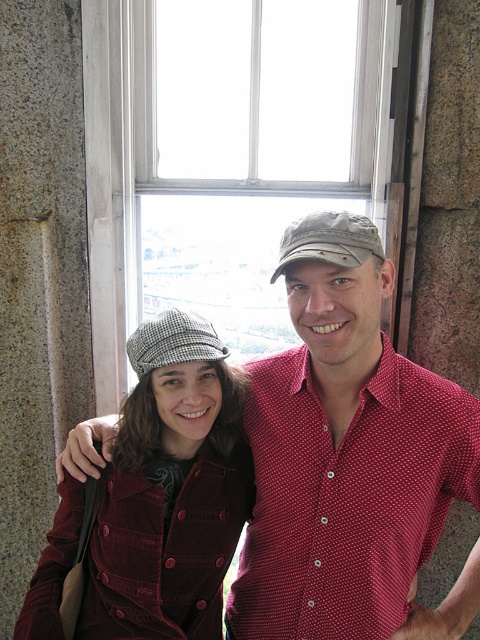
Measure the distance from red dotted shirt at center to velvet maroon coat at center.

A distance of 8.80 inches exists between red dotted shirt at center and velvet maroon coat at center.

Does red dotted shirt at center appear on the right side of velvet maroon coat at center?

Correct, you'll find red dotted shirt at center to the right of velvet maroon coat at center.

Is point (352, 612) farther from camera compared to point (183, 362)?

No, it is not.

Find the location of a particular element. red dotted shirt at center is located at coordinates (347, 497).

Is matte red shirt at center above velvet maroon coat at center?

Yes, matte red shirt at center is above velvet maroon coat at center.

The height and width of the screenshot is (640, 480). Find the location of `matte red shirt at center`. matte red shirt at center is located at coordinates (349, 458).

In the scene shown: Can you confirm if matte red shirt at center is wider than red dotted shirt at center?

Yes.

How distant is matte red shirt at center from red dotted shirt at center?

matte red shirt at center is 1.00 inches away from red dotted shirt at center.

You are a GUI agent. You are given a task and a screenshot of the screen. Output one action in this format:
    pyautogui.click(x=<x>, y=<y>)
    Task: Click on the matte red shirt at center
    
    Given the screenshot: What is the action you would take?
    pyautogui.click(x=349, y=458)